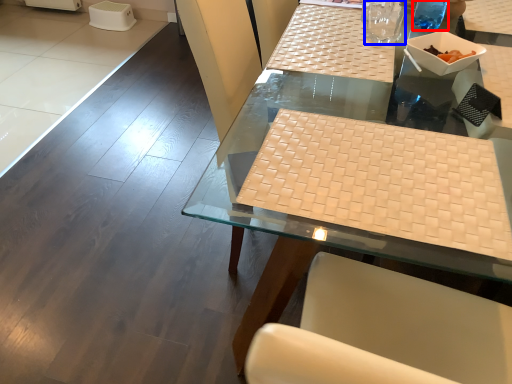
Question: Which object is further to the camera taking this photo, beverage (highlighted by a red box) or clear (highlighted by a blue box)?

Choices:
 (A) beverage
 (B) clear

Answer: (A)